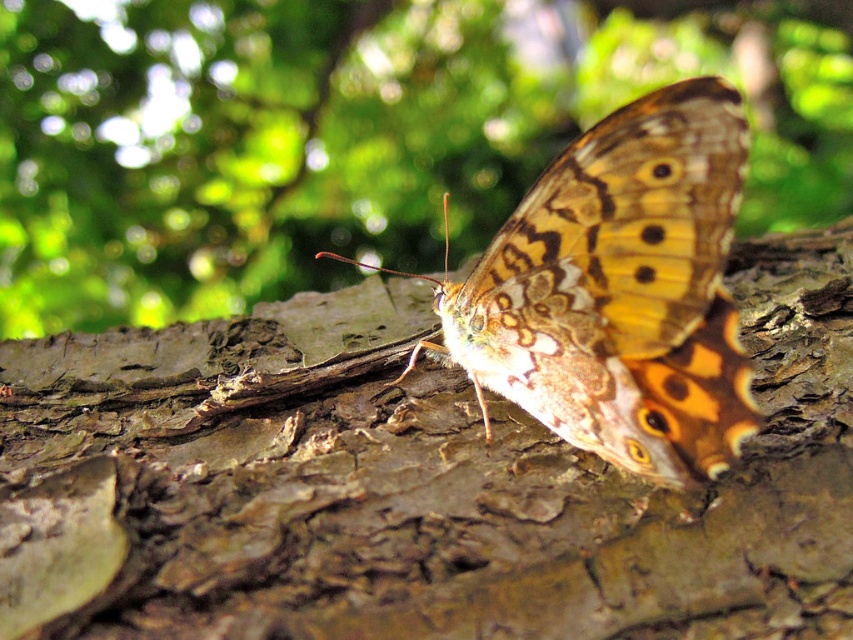
You are an entomologist observing a butterfly on a tree. You see the brown rough bark at center and the brown textured butterfly at center. Which object is taller?

The brown rough bark at center is much taller than the brown textured butterfly at center.

You are a photographer trying to capture the brown textured butterfly at center. You notice the brown rough bark at center is in the way. Can you adjust your camera angle to focus on the butterfly without moving the bark?

The brown rough bark at center is closer to the viewer than the brown textured butterfly at center, so adjusting the camera angle might not be sufficient. You may need to move closer or use a different lens to focus on the butterfly while keeping the bark in place.

You are an entomologist observing a butterfly in a natural setting. You notice the brown rough bark at center and the brown textured butterfly at center. Which object is positioned to the right?

The brown textured butterfly at center is positioned to the right of the brown rough bark at center.